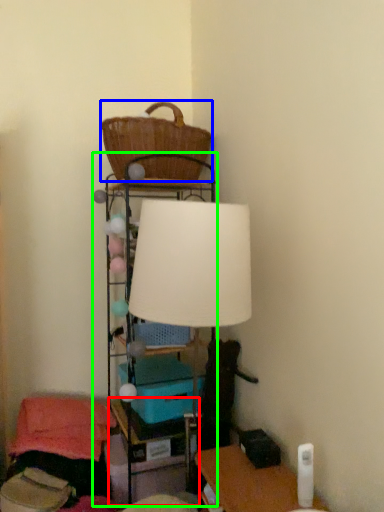
Question: Estimate the real-world distances between objects in this image. Which object is farther from table (highlighted by a red box), basket (highlighted by a blue box) or shelf (highlighted by a green box)?

Choices:
 (A) basket
 (B) shelf

Answer: (A)